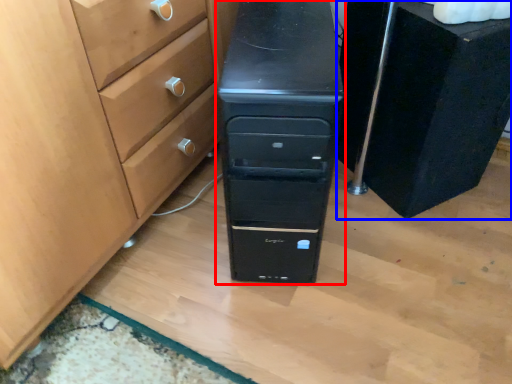
Question: Among these objects, which one is nearest to the camera, chest of drawers (highlighted by a red box) or chest of drawers (highlighted by a blue box)?

Choices:
 (A) chest of drawers
 (B) chest of drawers

Answer: (A)